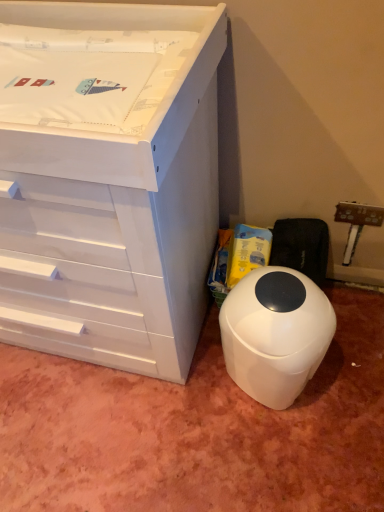
You are a GUI agent. You are given a task and a screenshot of the screen. Output one action in this format:
    pyautogui.click(x=<x>, y=<y>)
    Task: Click on the free space in front of white plastic waste bin at lower right
    The image size is (384, 512).
    Given the screenshot: What is the action you would take?
    pyautogui.click(x=276, y=452)